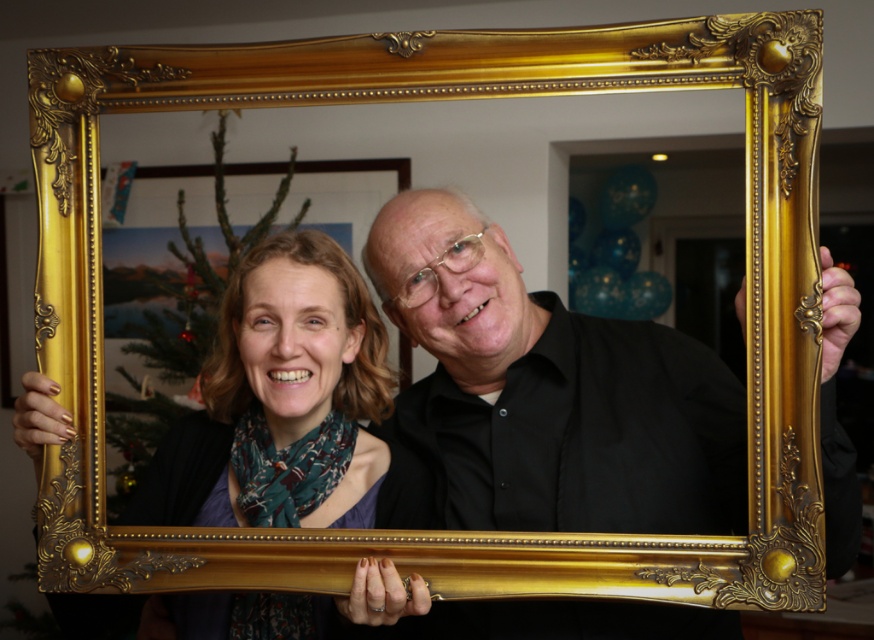
You are standing in front of the image and want to know which of the two points, point (470, 353) or point (295, 456), is closer to you. Based on the scene description, can you determine which point is nearer?

Point (470, 353) is in front of point (295, 456), so it is closer to you.

You are an interior designer assessing the placement of the black matte shirt at center and the matte gold frame at center in the image. Based on their positions, which object is closer to the ceiling?

The black matte shirt at center is above the matte gold frame at center, so it is closer to the ceiling.